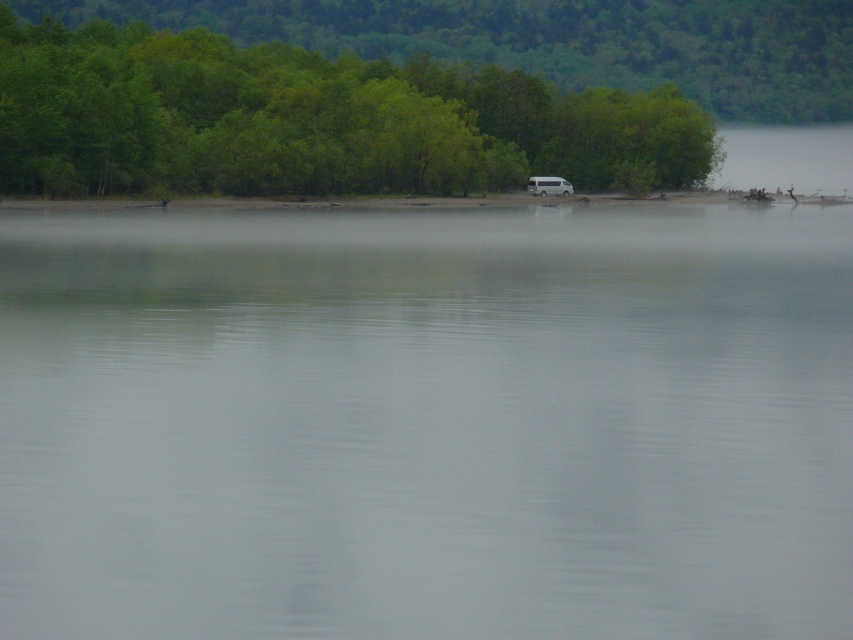
Question: Is clear water at center thinner than white matte van at center?

Choices:
 (A) no
 (B) yes

Answer: (A)

Question: Among these objects, which one is nearest to the camera?

Choices:
 (A) white matte van at center
 (B) clear water at center

Answer: (B)

Question: Which object is the farthest from the white matte van at center?

Choices:
 (A) clear water at center
 (B) green leafy trees at upper center

Answer: (A)

Question: Is green leafy trees at upper center in front of white matte van at center?

Choices:
 (A) yes
 (B) no

Answer: (A)

Question: Estimate the real-world distances between objects in this image. Which object is farther from the clear water at center?

Choices:
 (A) white matte van at center
 (B) green leafy trees at upper center

Answer: (A)

Question: Is clear water at center positioned at the back of white matte van at center?

Choices:
 (A) yes
 (B) no

Answer: (B)